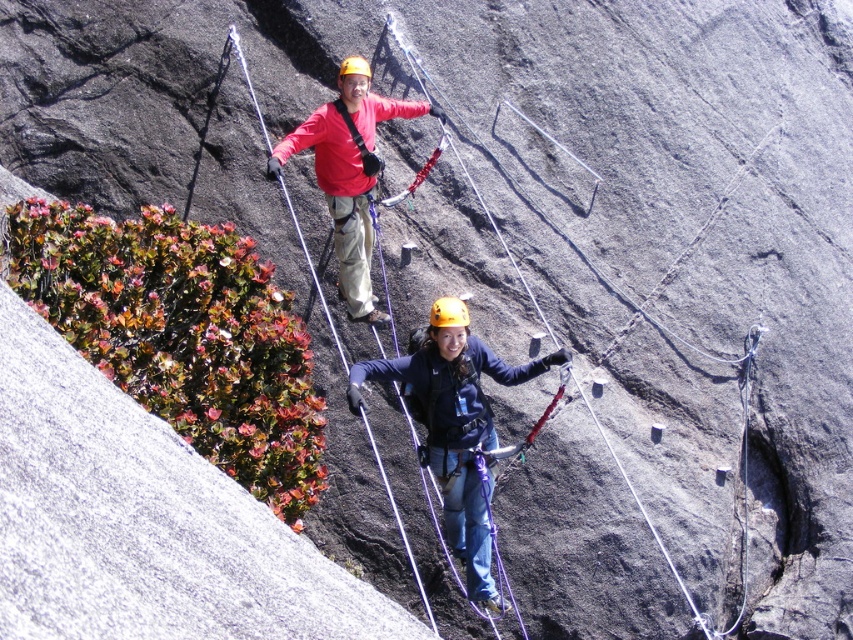
You are a drone operator tasked with capturing aerial footage of the rock climbing scene. Your drone is currently positioned above the rock face. To ensure safety, you need to avoid flying directly over any climbers. Which climber should you avoid flying over, the one wearing the matte blue jacket at center or the other climber?

You should avoid flying over the matte blue jacket at center because it is located at point (456, 433), which is the central area of the rock face where the climber is actively moving. The other climber is not specified in the coordinates, so it is safer to avoid the central position.

You are a safety officer assessing the climbing site. You need to check if the distance between the matte blue jacket at center and the camera is within the safe range of 20 meters. Is the distance within the safe limit?

The matte blue jacket at center is 17.47 meters away from camera, which is within the safe range of 20 meters. Therefore, the distance is within the safe limit.

You are a safety inspector checking the climbing setup. You notice the matte red jacket at upper center and the yellow matte helmet at center. Which object is positioned higher on the rock face?

The matte red jacket at upper center is much taller than the yellow matte helmet at center, so the matte red jacket at upper center is positioned higher on the rock face.